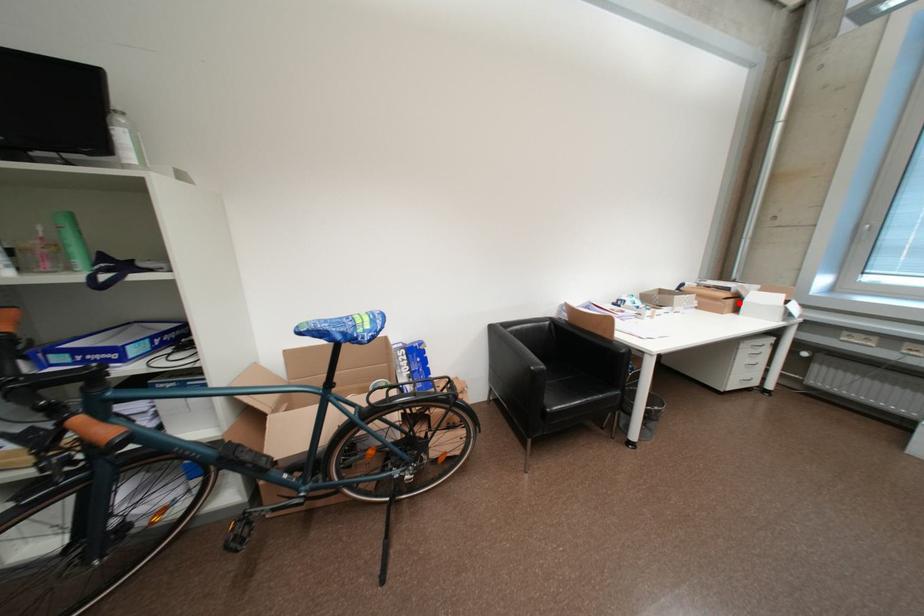
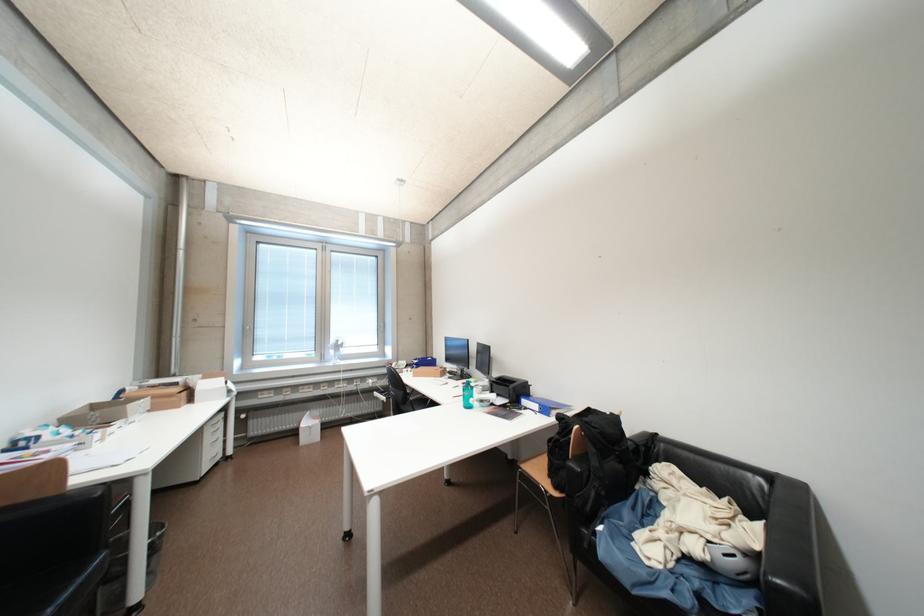
Find the pixel in the second image that matches the highlighted location in the first image.

(192, 395)